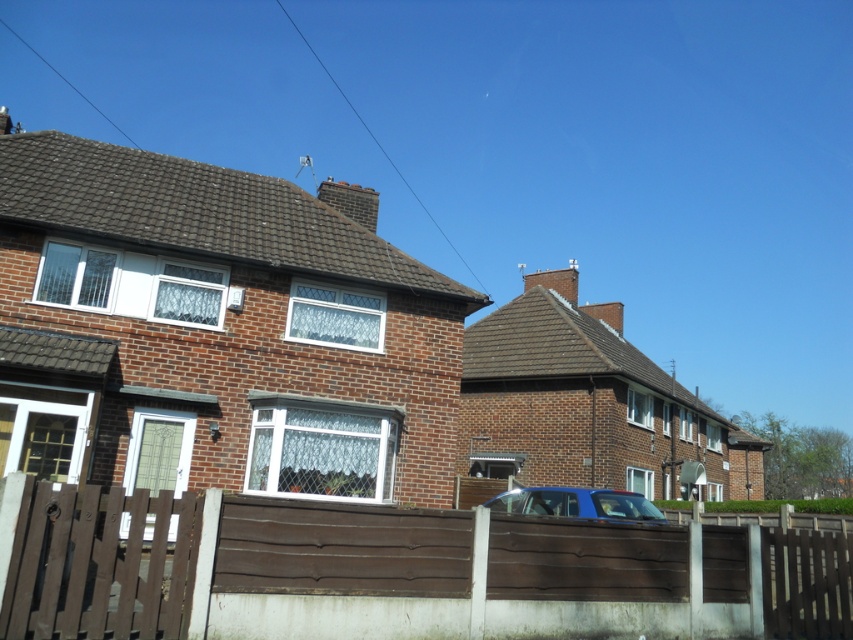
Question: Can you confirm if brown wooden fence at center is positioned above blue matte car at center?

Choices:
 (A) no
 (B) yes

Answer: (B)

Question: Does brown wooden fence at center have a smaller size compared to blue matte car at center?

Choices:
 (A) no
 (B) yes

Answer: (B)

Question: Which point appears closest to the camera in this image?

Choices:
 (A) (26, 616)
 (B) (631, 500)

Answer: (A)

Question: Can you confirm if brown wooden fence at center is positioned above blue matte car at center?

Choices:
 (A) no
 (B) yes

Answer: (B)